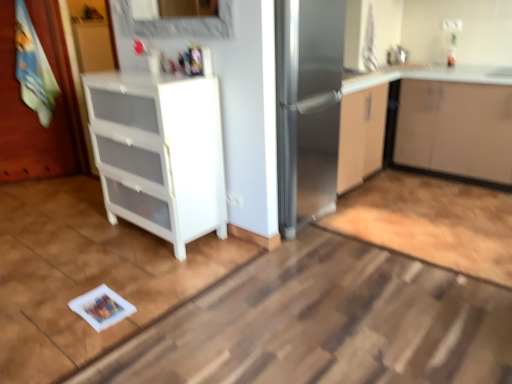
Find the location of a particular element. The height and width of the screenshot is (384, 512). free spot to the left of white plastic drawer unit at left, the 2th cabinetry positioned from the right is located at coordinates (73, 236).